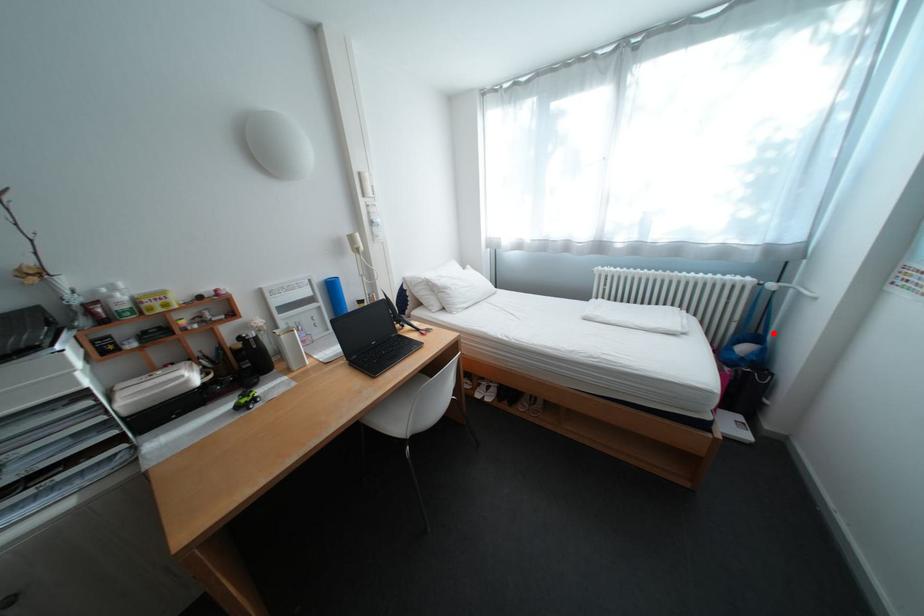
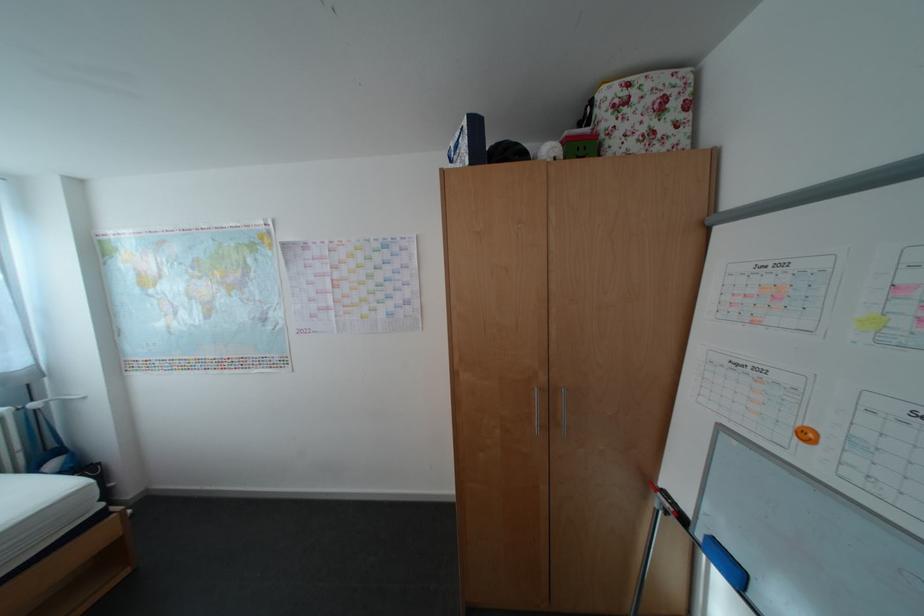
Question: I am providing you with two images of the same scene from different viewpoints. Given a red point in image1, look at the same physical point in image2. Is it:

Choices:
 (A) Closer to the viewpoint
 (B) Farther from the viewpoint

Answer: (B)